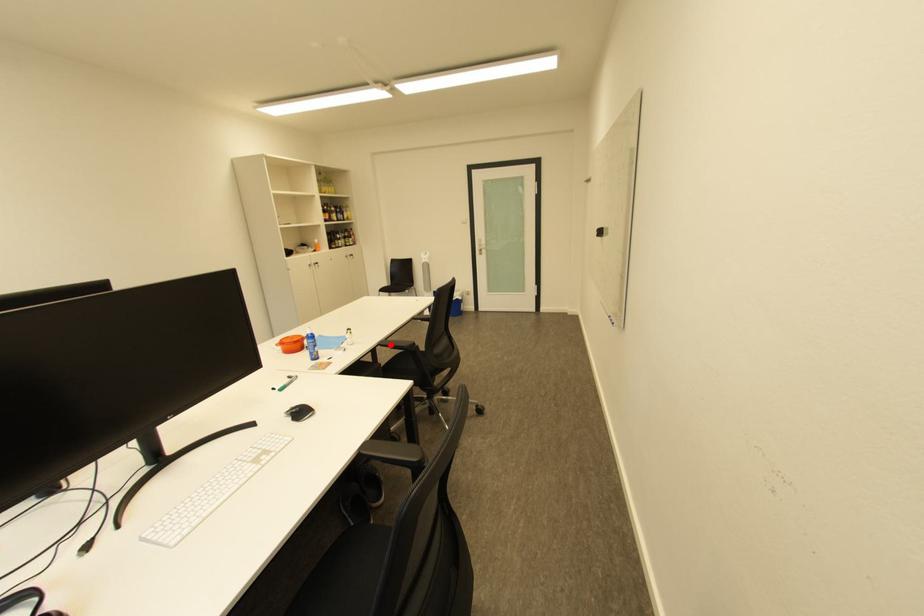
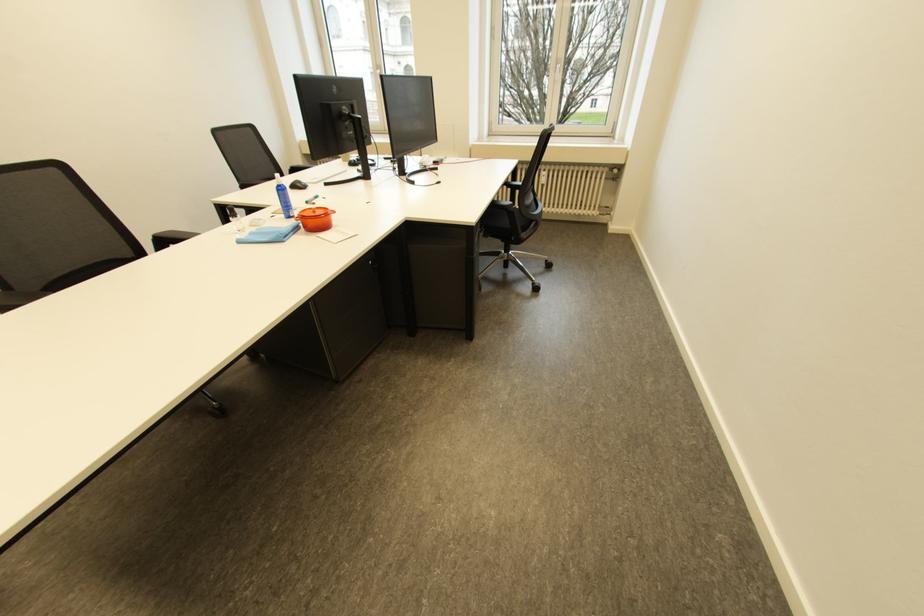
Question: I am providing you with two images of the same scene from different viewpoints. A red point is marked on the first image. At the location where the point appears in image 1, is it still visible in image 2?

Choices:
 (A) Yes
 (B) No

Answer: (B)